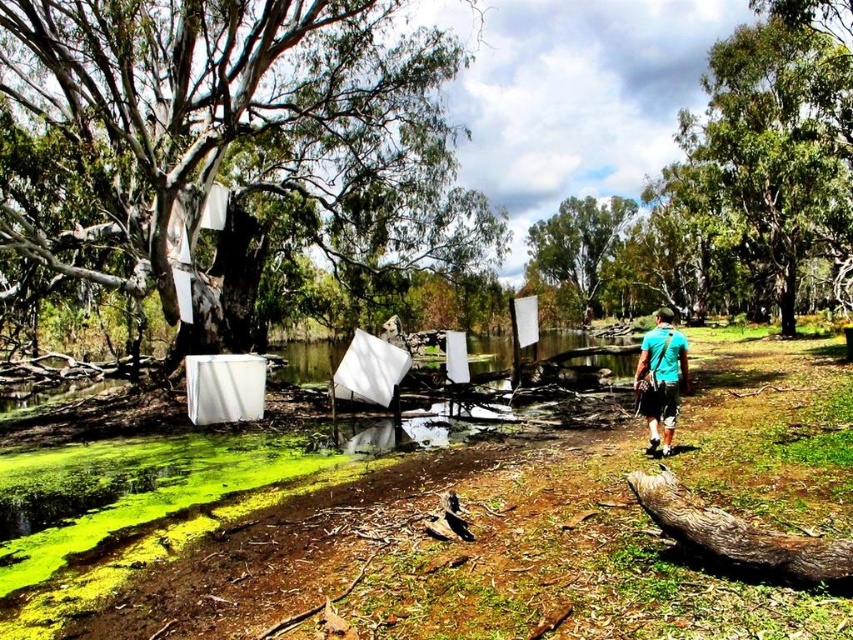
Is smooth bark tree at left above teal fabric shirt at center-right?

Indeed, smooth bark tree at left is positioned over teal fabric shirt at center-right.

Which is behind, point (461, 250) or point (634, 387)?

Positioned behind is point (461, 250).

Between point (335, 224) and point (675, 387), which one is positioned in front?

Point (675, 387) is in front.

Identify the location of smooth bark tree at left. This screenshot has height=640, width=853. (239, 131).

At what (x,y) coordinates should I click in order to perform the action: click on smooth bark tree at left. Please return your answer as a coordinate pair (x, y). Looking at the image, I should click on (239, 131).

Is smooth bark tree at left further to camera compared to green leafy tree at upper center?

No.

Is point (22, 77) more distant than point (581, 292)?

That is False.

Identify the location of smooth bark tree at left. (239, 131).

Can you confirm if green leafy tree at upper center is bigger than teal fabric shirt at center-right?

Yes.

Which is above, green leafy tree at upper center or teal fabric shirt at center-right?

green leafy tree at upper center is higher up.

Does point (543, 246) come behind point (665, 362)?

That is True.

Find the location of a particular element. The image size is (853, 640). green leafy tree at upper center is located at coordinates (579, 244).